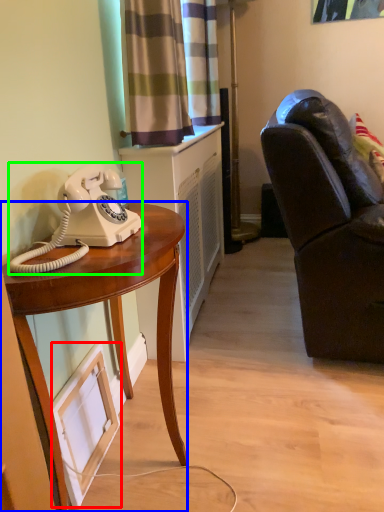
Question: Which is farther away from picture frame (highlighted by a red box)? desk (highlighted by a blue box) or corded phone (highlighted by a green box)?

Choices:
 (A) desk
 (B) corded phone

Answer: (B)